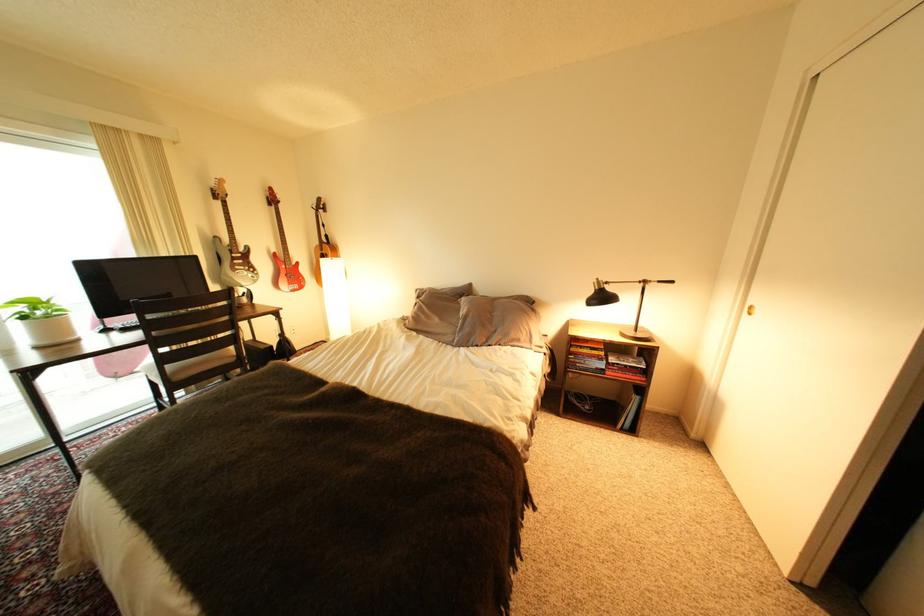
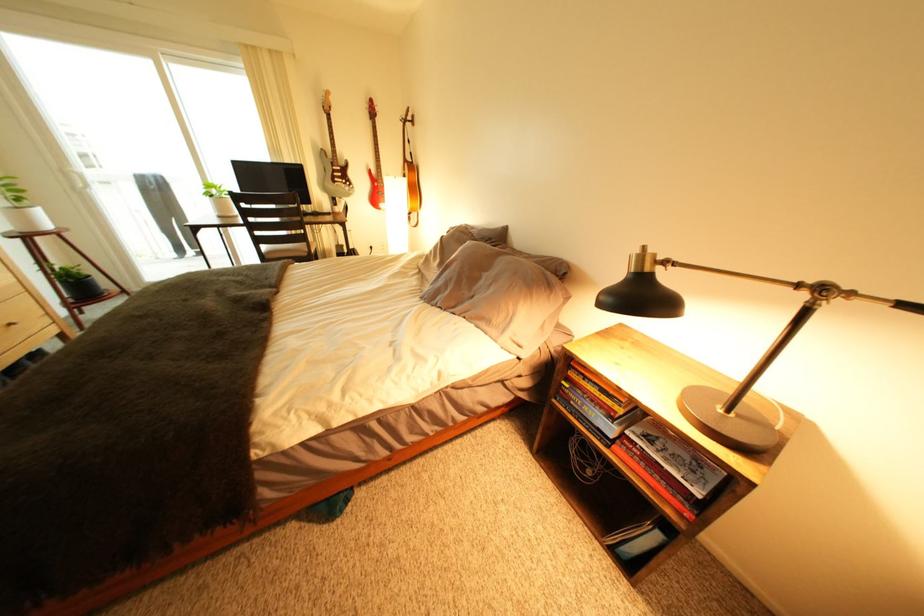
In the second image, find the point that corresponds to the point at 658,284 in the first image.

(834, 291)